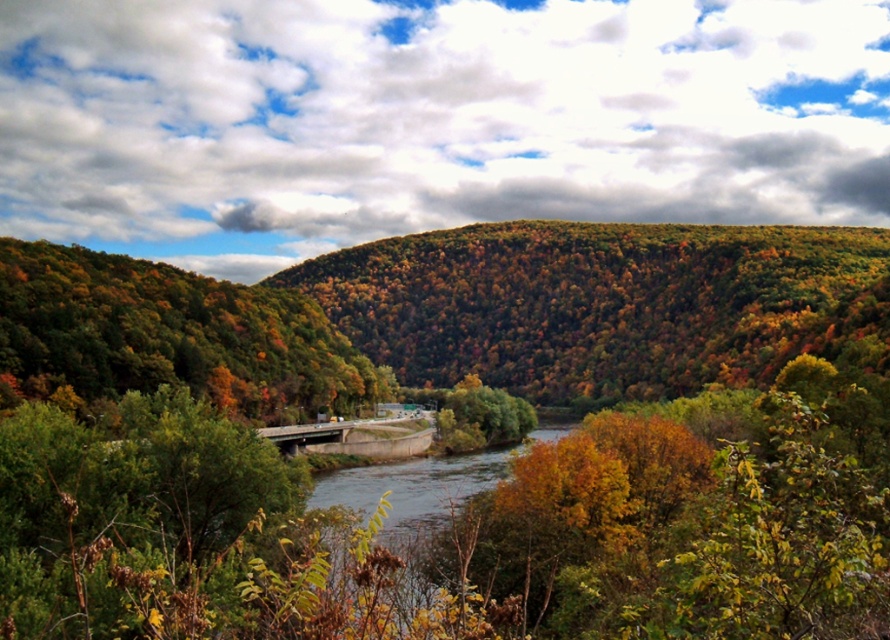
Question: Is autumn foliage at center wider than green leafy tree at center?

Choices:
 (A) no
 (B) yes

Answer: (B)

Question: From the image, what is the correct spatial relationship of green leafy tree at center in relation to concrete bridge at center?

Choices:
 (A) above
 (B) below

Answer: (B)

Question: Which of these objects is positioned farthest from the green leafy trees at center?

Choices:
 (A) green leafy tree at center
 (B) concrete bridge at center
 (C) autumn foliage at center
 (D) green leafy hillside at center

Answer: (C)

Question: Can you confirm if green leafy hillside at center is positioned above autumn foliage at center?

Choices:
 (A) yes
 (B) no

Answer: (B)

Question: Which point is closer to the camera taking this photo?

Choices:
 (A) (386, 440)
 (B) (346, 282)

Answer: (A)

Question: Estimate the real-world distances between objects in this image. Which object is closer to the green leafy hillside at center?

Choices:
 (A) concrete bridge at center
 (B) green leafy tree at center
 (C) smooth concrete river at center

Answer: (A)